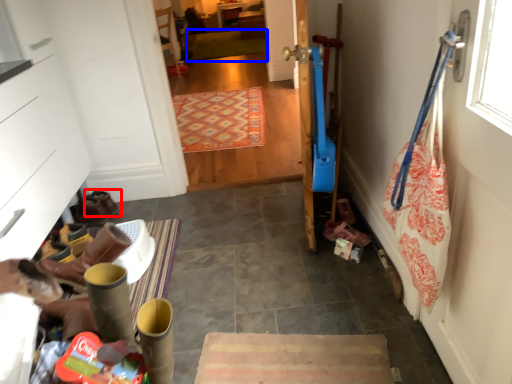
Question: Among these objects, which one is farthest to the camera, footwear (highlighted by a red box) or mat (highlighted by a blue box)?

Choices:
 (A) footwear
 (B) mat

Answer: (B)